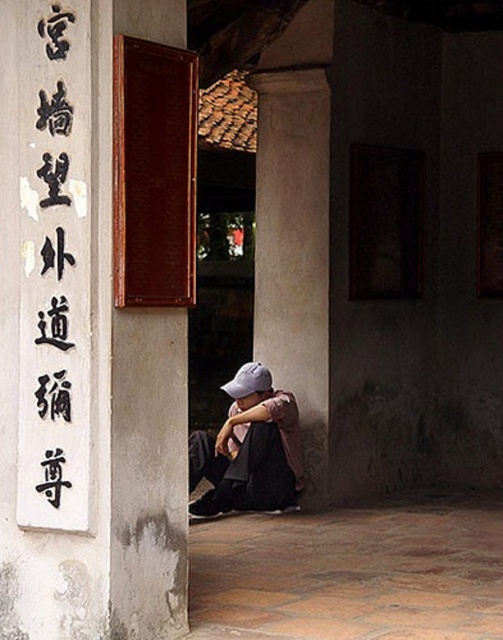
Between white stone sign at upper left and denim jacket at lower center, which one appears on the right side from the viewer's perspective?

From the viewer's perspective, denim jacket at lower center appears more on the right side.

Who is positioned more to the left, white stone sign at upper left or denim jacket at lower center?

From the viewer's perspective, white stone sign at upper left appears more on the left side.

Does point (64, 580) come farther from viewer compared to point (220, 486)?

No.

Find the location of a particular element. This screenshot has width=503, height=640. white stone sign at upper left is located at coordinates [81, 348].

Does white stone sign at upper left have a smaller size compared to smooth concrete pillar at lower center?

Actually, white stone sign at upper left might be larger than smooth concrete pillar at lower center.

Who is positioned more to the right, white stone sign at upper left or smooth concrete pillar at lower center?

smooth concrete pillar at lower center

Is point (80, 248) closer to camera compared to point (322, 220)?

Yes, it is in front of point (322, 220).

In order to click on white stone sign at upper left in this screenshot , I will do `click(81, 348)`.

Is point (269, 49) positioned behind point (46, 397)?

Yes, it is behind point (46, 397).

Is point (317, 12) positioned in front of point (68, 4)?

No.

This screenshot has height=640, width=503. What are the coordinates of `smooth concrete pillar at lower center` in the screenshot? It's located at (295, 225).